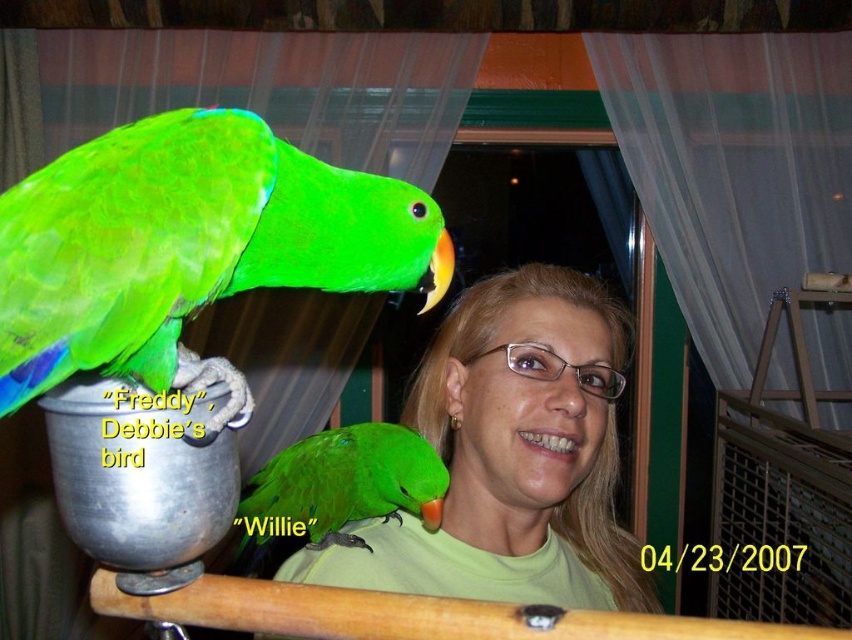
Based on the photo, which is more to the left, matte green shirt at center or green matte parrot at shoulder?

green matte parrot at shoulder

Describe the element at coordinates (513, 456) in the screenshot. Image resolution: width=852 pixels, height=640 pixels. I see `matte green shirt at center` at that location.

Image resolution: width=852 pixels, height=640 pixels. Describe the element at coordinates (513, 456) in the screenshot. I see `matte green shirt at center` at that location.

Locate an element on the screen. matte green shirt at center is located at coordinates (513, 456).

Who is lower down, green matte parrot at upper left or green matte parrot at shoulder?

green matte parrot at shoulder is lower down.

Which is above, green matte parrot at upper left or green matte parrot at shoulder?

Positioned higher is green matte parrot at upper left.

I want to click on green matte parrot at upper left, so click(188, 244).

Locate an element on the screen. This screenshot has height=640, width=852. green matte parrot at upper left is located at coordinates (188, 244).

Does green matte parrot at upper left have a lesser width compared to matte green shirt at center?

Yes.

Does green matte parrot at upper left have a larger size compared to matte green shirt at center?

No.

This screenshot has width=852, height=640. Identify the location of green matte parrot at upper left. (188, 244).

Where is `green matte parrot at upper left`? The image size is (852, 640). green matte parrot at upper left is located at coordinates (188, 244).